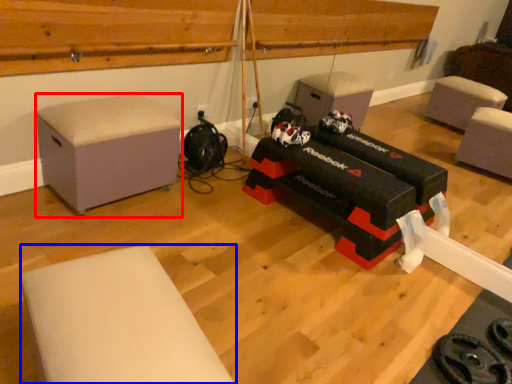
Question: Which point is closer to the camera, furniture (highlighted by a red box) or furniture (highlighted by a blue box)?

Choices:
 (A) furniture
 (B) furniture

Answer: (B)